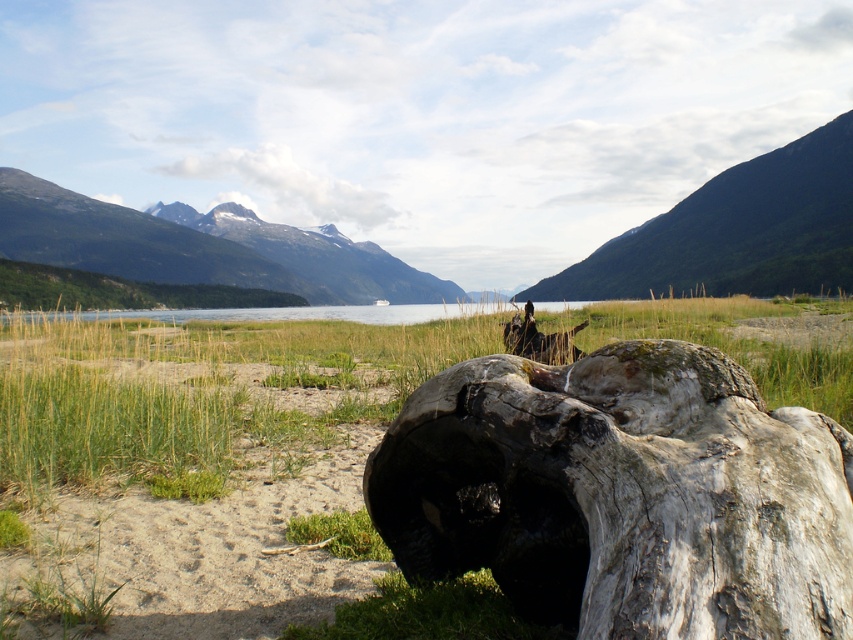
You are standing on the beach looking towards the water. You see the green grass at lower left and the green textured mountain at upper center. Which object is closer to your left side?

The green grass at lower left is closer to your left side as it is positioned to the left of the green textured mountain at upper center.

You are a hiker planning to traverse from the green forested mountain at upper left to the green textured mountain at upper center. Given that your average walking pace is 3 miles per hour, how long would it take you to walk directly between the two mountains?

The distance between the green textured mountain at upper center and the green forested mountain at upper left is 111.13 feet. Converting this to miles, it is approximately 0.021 miles. At a pace of 3 miles per hour, it would take roughly 0.021 divided by 3 hours, which is about 0.007 hours or roughly 0.42 minutes, approximately 25 seconds.

You are standing on the beach and want to walk towards the water. Which area would you cross first, the green grass at lower left or the green textured mountain at upper center?

The green grass at lower left is closer to you, so you would cross it first.